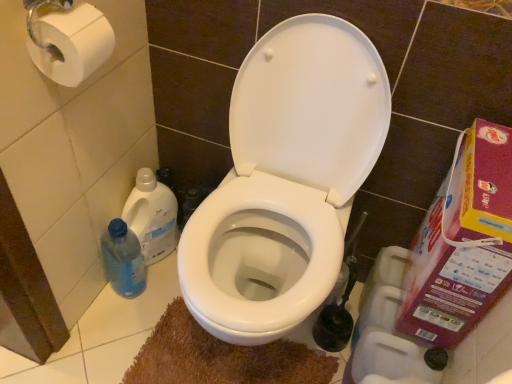
Question: Is plastic cardboard box at right inside the boundaries of white glossy toilet at center, or outside?

Choices:
 (A) outside
 (B) inside

Answer: (A)

Question: In terms of height, does plastic cardboard box at right look taller or shorter compared to white glossy toilet at center?

Choices:
 (A) tall
 (B) short

Answer: (B)

Question: Based on their relative distances, which object is farther from the blue translucent bottle at left, which ranks as the first cleaning product in bottom-to-top order?

Choices:
 (A) white matte toilet paper at lower right, positioned as the 2th toilet paper in left-to-right order
 (B) white glossy toilet at center
 (C) translucent plastic bottle at lower left, arranged as the 2th cleaning product when ordered from the bottom
 (D) white paper at upper left, which is the 1th toilet paper in top-to-bottom order
 (E) plastic cardboard box at right

Answer: (E)

Question: Estimate the real-world distances between objects in this image. Which object is closer to the brown plush bath mat at lower center?

Choices:
 (A) white glossy toilet at center
 (B) translucent plastic bottle at lower left, arranged as the 2th cleaning product when ordered from the bottom
 (C) white matte toilet paper at lower right, arranged as the first toilet paper when viewed from the back
 (D) white paper at upper left, which appears as the 2th toilet paper when ordered from the bottom
 (E) blue translucent bottle at left, which ranks as the first cleaning product in bottom-to-top order

Answer: (E)